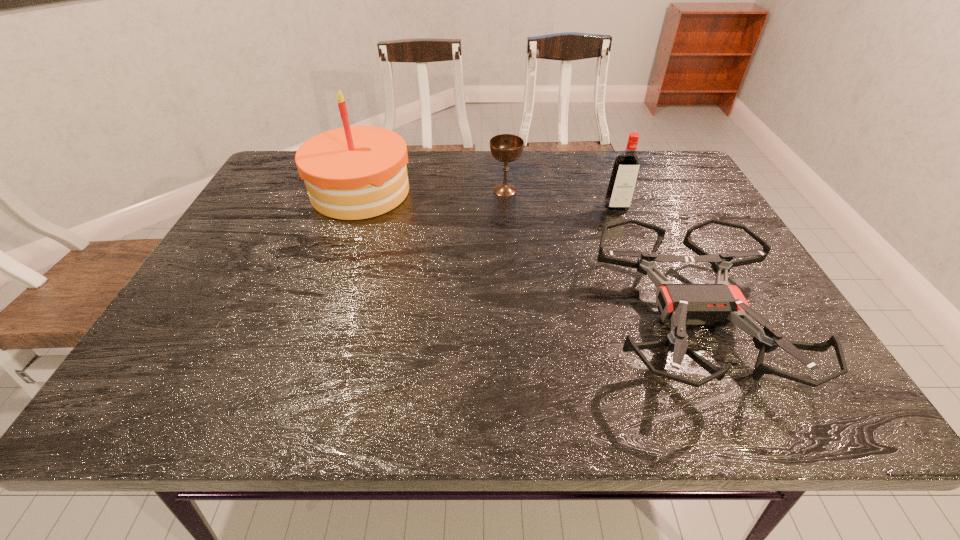
Where is `blank region between the chalice and the birthday cake`? The width and height of the screenshot is (960, 540). blank region between the chalice and the birthday cake is located at coordinates (433, 191).

At what (x,y) coordinates should I click in order to perform the action: click on the second closest object to the chalice. Please return your answer as a coordinate pair (x, y). Looking at the image, I should click on (626, 167).

Identify which object is the closest to the shortest object. Please provide its 2D coordinates. Your answer should be formatted as a tuple, i.e. [(x, y)], where the tuple contains the x and y coordinates of a point satisfying the conditions above.

[(626, 167)]

Find the location of `free spot that satisfies the following two spatial constraints: 1. on the back side of the leftmost object; 2. on the right side of the third tallest object`. free spot that satisfies the following two spatial constraints: 1. on the back side of the leftmost object; 2. on the right side of the third tallest object is located at coordinates [361, 190].